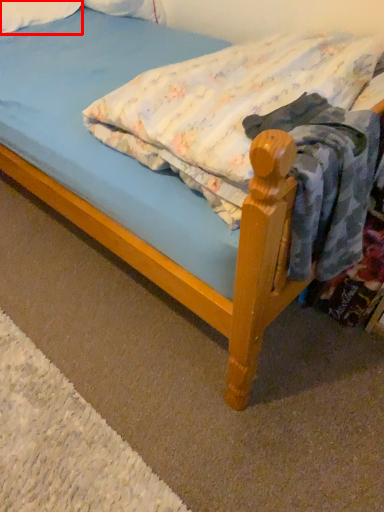
Question: From the image, what is the correct spatial relationship of pillow (annotated by the red box) in relation to mattress?

Choices:
 (A) right
 (B) left

Answer: (B)